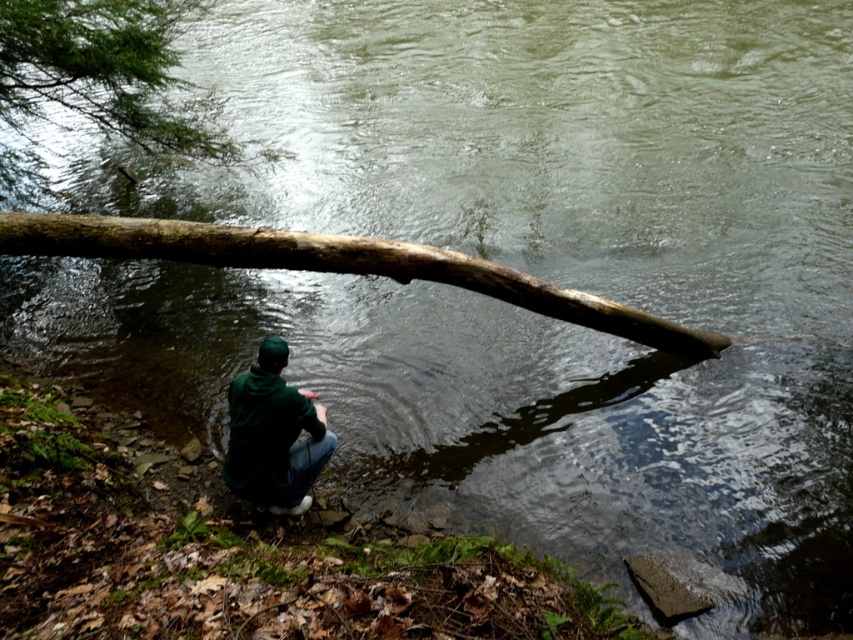
Is point (71, 253) positioned in front of point (228, 442)?

No, it is behind (228, 442).

In the scene shown: Who is higher up, brown rough log at center or dark green hoodie at lower center?

brown rough log at center is above.

The height and width of the screenshot is (640, 853). Find the location of `brown rough log at center`. brown rough log at center is located at coordinates (338, 266).

Find the location of a particular element. brown rough log at center is located at coordinates point(338,266).